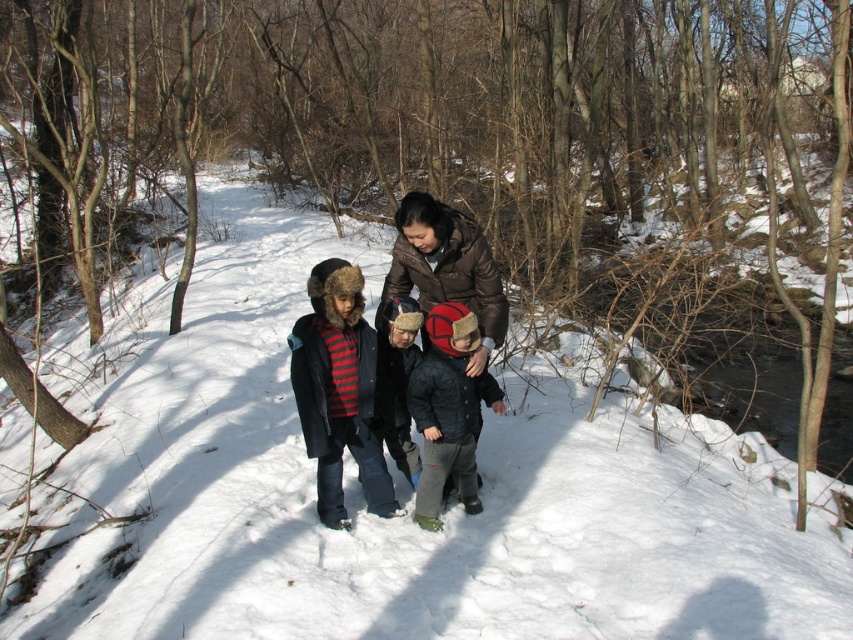
Question: Which object is the farthest from the dark brown fur-lined coat at center?

Choices:
 (A) brown fuzzy coat at center
 (B) dark blue jacket at center

Answer: (B)

Question: Which object is positioned farthest from the dark brown fur-lined coat at center?

Choices:
 (A) brown fuzzy coat at center
 (B) dark blue jacket at center

Answer: (B)

Question: Among these points, which one is farthest from the camera?

Choices:
 (A) (491, 348)
 (B) (453, 321)

Answer: (A)

Question: Does dark brown fur-lined coat at center appear on the right side of dark blue jacket at center?

Choices:
 (A) yes
 (B) no

Answer: (B)

Question: Is dark blue jacket at center wider than brown fuzzy coat at center?

Choices:
 (A) no
 (B) yes

Answer: (A)

Question: Does dark blue jacket at center come in front of brown fuzzy coat at center?

Choices:
 (A) yes
 (B) no

Answer: (A)